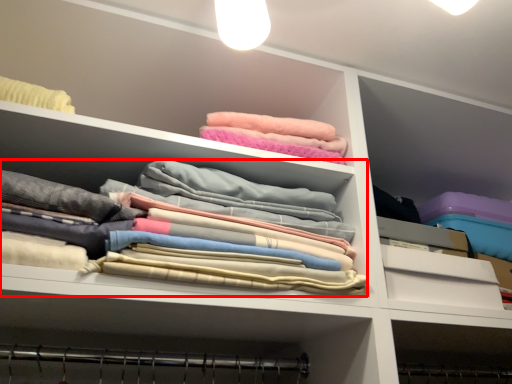
Question: From the image's perspective, considering the relative positions of clothing (annotated by the red box) and drawer in the image provided, where is clothing (annotated by the red box) located with respect to the staircase?

Choices:
 (A) above
 (B) below

Answer: (A)